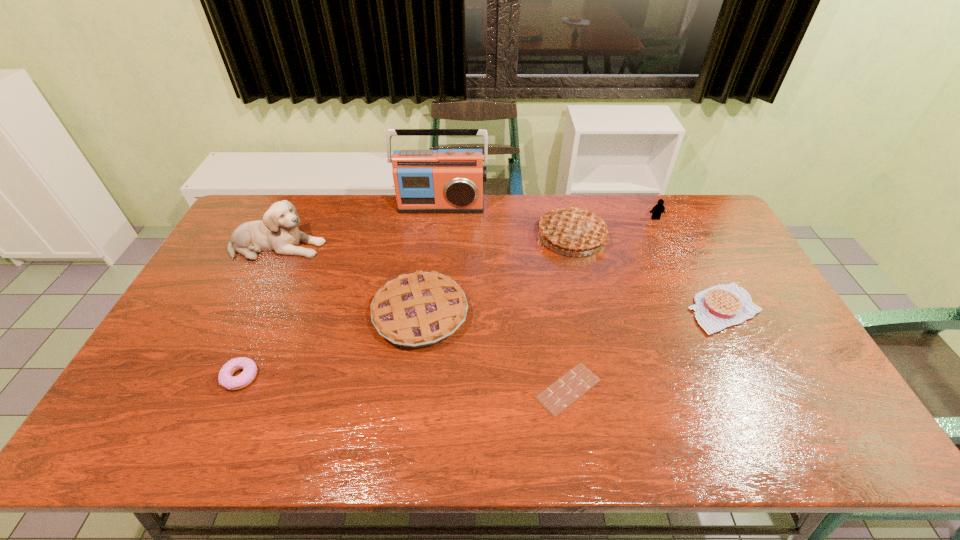
Find the location of a particular element. The width and height of the screenshot is (960, 540). the tallest object is located at coordinates (445, 180).

Where is `the second pie from left to right`? the second pie from left to right is located at coordinates (574, 229).

Find the location of a particular element. The height and width of the screenshot is (540, 960). the tallest pie is located at coordinates (574, 229).

The image size is (960, 540). What are the coordinates of `puppy` in the screenshot? It's located at (278, 231).

Find the location of a particular element. The height and width of the screenshot is (540, 960). the fifth shortest object is located at coordinates (658, 209).

At what (x,y) coordinates should I click in order to perform the action: click on the fourth shortest object. Please return your answer as a coordinate pair (x, y). Looking at the image, I should click on (420, 309).

The image size is (960, 540). Identify the location of the second shortest pie. (420, 309).

Find the location of a particular element. The image size is (960, 540). the shortest pie is located at coordinates (723, 305).

You are a GUI agent. You are given a task and a screenshot of the screen. Output one action in this format:
    pyautogui.click(x=<x>, y=<y>)
    Task: Click on the doughnut
    This screenshot has width=960, height=540.
    Given the screenshot: What is the action you would take?
    click(225, 378)

Where is `chocolate bar`? chocolate bar is located at coordinates (559, 395).